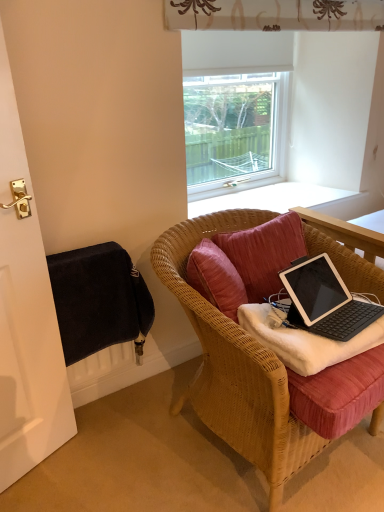
This screenshot has height=512, width=384. What are the coordinates of `blank space situated above white soft blanket at center (from a real-world perspective)` in the screenshot? It's located at (340, 313).